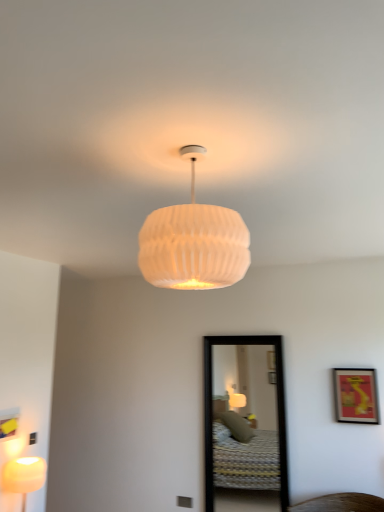
Where is `white ribbed shade at center, which appears as the 1th lamp when viewed from the front`? The width and height of the screenshot is (384, 512). white ribbed shade at center, which appears as the 1th lamp when viewed from the front is located at coordinates (193, 242).

Measure the distance between black-framed mirror at center and camera.

The distance of black-framed mirror at center from camera is 3.87 meters.

The image size is (384, 512). In order to click on matte white lamp at lower left, marked as the 1th lamp in a back-to-front arrangement in this screenshot , I will do `click(23, 476)`.

In the image, is matte red picture frame at right positioned in front of or behind white ribbed shade at center, placed as the second lamp when sorted from back to front?

matte red picture frame at right is behind white ribbed shade at center, placed as the second lamp when sorted from back to front.

Between matte red picture frame at right and white ribbed shade at center, which is counted as the second lamp, starting from the bottom, which one has more height?

white ribbed shade at center, which is counted as the second lamp, starting from the bottom.

From a real-world perspective, is matte red picture frame at right positioned under white ribbed shade at center, placed as the second lamp when sorted from back to front, based on gravity?

Indeed, from a real-world perspective, matte red picture frame at right is positioned beneath white ribbed shade at center, placed as the second lamp when sorted from back to front.

Could you measure the distance between matte red picture frame at right and white ribbed shade at center, placed as the first lamp when sorted from top to bottom?

A distance of 8.19 feet exists between matte red picture frame at right and white ribbed shade at center, placed as the first lamp when sorted from top to bottom.

Is matte white lamp at lower left, the second lamp when ordered from front to back, situated inside white ribbed shade at center, which appears as the 1th lamp when viewed from the front, or outside?

matte white lamp at lower left, the second lamp when ordered from front to back, cannot be found inside white ribbed shade at center, which appears as the 1th lamp when viewed from the front.

How different are the orientations of matte white lamp at lower left, the second lamp when ordered from front to back, and white ribbed shade at center, placed as the first lamp when sorted from top to bottom, in degrees?

179 degrees.

From the image's perspective, which one is positioned lower, matte white lamp at lower left, the 2th lamp when ordered from right to left, or white ribbed shade at center, positioned as the 2th lamp in left-to-right order?

matte white lamp at lower left, the 2th lamp when ordered from right to left, appears lower in the image.

From a real-world perspective, who is located lower, matte white lamp at lower left, the 2th lamp when ordered from right to left, or white ribbed shade at center, the 1th lamp when ordered from right to left?

matte white lamp at lower left, the 2th lamp when ordered from right to left, is physically lower.

Is matte red picture frame at right oriented towards black-framed mirror at center?

No, matte red picture frame at right is not aimed at black-framed mirror at center.

Considering the sizes of matte red picture frame at right and black-framed mirror at center in the image, is matte red picture frame at right wider or thinner than black-framed mirror at center?

In the image, matte red picture frame at right appears to be more narrow than black-framed mirror at center.

Considering the positions of objects matte red picture frame at right and black-framed mirror at center in the image provided, who is more to the left, matte red picture frame at right or black-framed mirror at center?

From the viewer's perspective, black-framed mirror at center appears more on the left side.

Can you confirm if matte red picture frame at right is wider than matte white lamp at lower left, the second lamp when ordered from front to back?

No.

How much distance is there between matte red picture frame at right and matte white lamp at lower left, which appears as the 1th lamp when ordered from the bottom?

matte red picture frame at right is 2.44 meters away from matte white lamp at lower left, which appears as the 1th lamp when ordered from the bottom.

Based on the photo, from a real-world perspective, is matte red picture frame at right physically located above or below matte white lamp at lower left, the second lamp when ordered from front to back?

matte red picture frame at right is above matte white lamp at lower left, the second lamp when ordered from front to back.

From the image's perspective, which is above, matte red picture frame at right or matte white lamp at lower left, the second lamp when ordered from front to back?

From the image's view, matte red picture frame at right is above.

What's the angular difference between matte white lamp at lower left, marked as the 1th lamp in a back-to-front arrangement, and matte red picture frame at right's facing directions?

They differ by 89.5 degrees in their facing directions.

Where is `lamp that appears below the matte red picture frame at right (from a real-world perspective)`? This screenshot has width=384, height=512. lamp that appears below the matte red picture frame at right (from a real-world perspective) is located at coordinates (23, 476).

Is matte white lamp at lower left, the second lamp when ordered from front to back, oriented towards matte red picture frame at right?

No, matte white lamp at lower left, the second lamp when ordered from front to back, is not oriented towards matte red picture frame at right.

Between matte white lamp at lower left, which is the 1th lamp from left to right, and matte red picture frame at right, which one has smaller width?

matte red picture frame at right.

Considering the sizes of objects black-framed mirror at center and matte white lamp at lower left, which appears as the 1th lamp when ordered from the bottom, in the image provided, who is taller, black-framed mirror at center or matte white lamp at lower left, which appears as the 1th lamp when ordered from the bottom,?

black-framed mirror at center is taller.

Is black-framed mirror at center further to camera compared to matte white lamp at lower left, marked as the 1th lamp in a back-to-front arrangement?

Yes, black-framed mirror at center is behind matte white lamp at lower left, marked as the 1th lamp in a back-to-front arrangement.

From a real-world perspective, is black-framed mirror at center located higher than matte white lamp at lower left, which appears as the 1th lamp when ordered from the bottom?

Yes.

In the image, is matte white lamp at lower left, marked as the 1th lamp in a back-to-front arrangement, positioned in front of or behind black-framed mirror at center?

Visually, matte white lamp at lower left, marked as the 1th lamp in a back-to-front arrangement, is located in front of black-framed mirror at center.

Does point (26, 486) come farther from viewer compared to point (252, 338)?

No, (26, 486) is closer to viewer.

Is matte white lamp at lower left, the second lamp when ordered from front to back, not inside black-framed mirror at center?

Yes.

Find the location of a particular element. mirror above the matte white lamp at lower left, which is the 1th lamp from left to right (from the image's perspective) is located at coordinates (245, 421).

From the matte red picture frame at right, count the 1st lamp to the left and point to it. Please provide its 2D coordinates.

[(193, 242)]

You are a GUI agent. You are given a task and a screenshot of the screen. Output one action in this format:
    pyautogui.click(x=<x>, y=<y>)
    Task: Click on the lamp in front of the matte white lamp at lower left, the 2th lamp when ordered from right to left
    The image size is (384, 512).
    Given the screenshot: What is the action you would take?
    pos(193,242)

Consider the image. Estimate the real-world distances between objects in this image. Which object is closer to matte white lamp at lower left, positioned as the second lamp in top-to-bottom order, matte red picture frame at right or black-framed mirror at center?

black-framed mirror at center is positioned closer to the anchor matte white lamp at lower left, positioned as the second lamp in top-to-bottom order.

Based on their spatial positions, is matte white lamp at lower left, which is the 1th lamp from left to right, or black-framed mirror at center closer to white ribbed shade at center, positioned as the 2th lamp in left-to-right order?

matte white lamp at lower left, which is the 1th lamp from left to right, lies closer to white ribbed shade at center, positioned as the 2th lamp in left-to-right order, than the other object.

Which object lies further to the anchor point white ribbed shade at center, which is counted as the second lamp, starting from the bottom, matte red picture frame at right or black-framed mirror at center?

black-framed mirror at center.

When comparing their distances from matte red picture frame at right, does matte white lamp at lower left, the second lamp when ordered from front to back, or black-framed mirror at center seem closer?

Among the two, black-framed mirror at center is located nearer to matte red picture frame at right.

From the picture: Estimate the real-world distances between objects in this image. Which object is closer to black-framed mirror at center, matte white lamp at lower left, marked as the 1th lamp in a back-to-front arrangement, or matte red picture frame at right?

The object closer to black-framed mirror at center is matte red picture frame at right.

Looking at the image, which one is located closer to matte white lamp at lower left, positioned as the second lamp in top-to-bottom order, white ribbed shade at center, which appears as the 1th lamp when viewed from the front, or matte red picture frame at right?

white ribbed shade at center, which appears as the 1th lamp when viewed from the front, lies closer to matte white lamp at lower left, positioned as the second lamp in top-to-bottom order, than the other object.

When comparing their distances from matte white lamp at lower left, marked as the 1th lamp in a back-to-front arrangement, does black-framed mirror at center or white ribbed shade at center, the 1th lamp when ordered from right to left, seem closer?

Result: black-framed mirror at center is closer to matte white lamp at lower left, marked as the 1th lamp in a back-to-front arrangement.

Estimate the real-world distances between objects in this image. Which object is closer to black-framed mirror at center, matte red picture frame at right or white ribbed shade at center, positioned as the 2th lamp in left-to-right order?

matte red picture frame at right is closer to black-framed mirror at center.

Where is `picture frame between white ribbed shade at center, positioned as the 2th lamp in left-to-right order, and black-framed mirror at center, along the z-axis`? The height and width of the screenshot is (512, 384). picture frame between white ribbed shade at center, positioned as the 2th lamp in left-to-right order, and black-framed mirror at center, along the z-axis is located at coordinates (356, 395).

Locate an element on the screen. This screenshot has height=512, width=384. mirror between matte white lamp at lower left, which is the 1th lamp from left to right, and matte red picture frame at right, in the horizontal direction is located at coordinates (245, 421).

Locate an element on the screen. The image size is (384, 512). lamp situated between matte white lamp at lower left, the 2th lamp when ordered from right to left, and matte red picture frame at right from left to right is located at coordinates (193, 242).

The image size is (384, 512). Identify the location of lamp positioned between white ribbed shade at center, placed as the second lamp when sorted from back to front, and black-framed mirror at center from near to far. (23, 476).